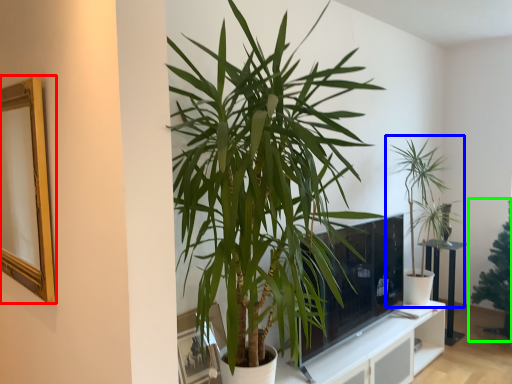
Question: Which is farther away from picture frame (highlighted by a red box)? houseplant (highlighted by a blue box) or houseplant (highlighted by a green box)?

Choices:
 (A) houseplant
 (B) houseplant

Answer: (B)